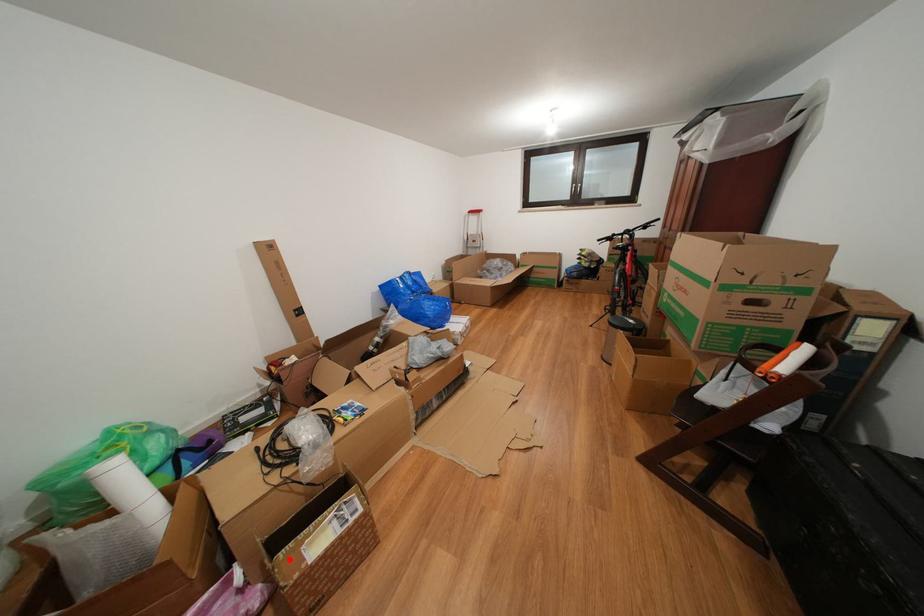
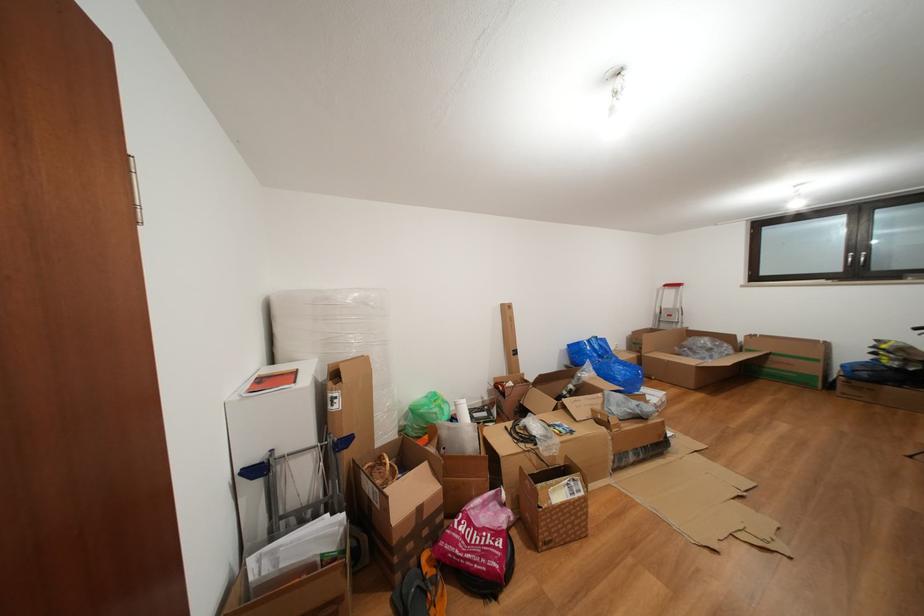
Find the pixel in the second image that matches the highlighted location in the first image.

(546, 491)